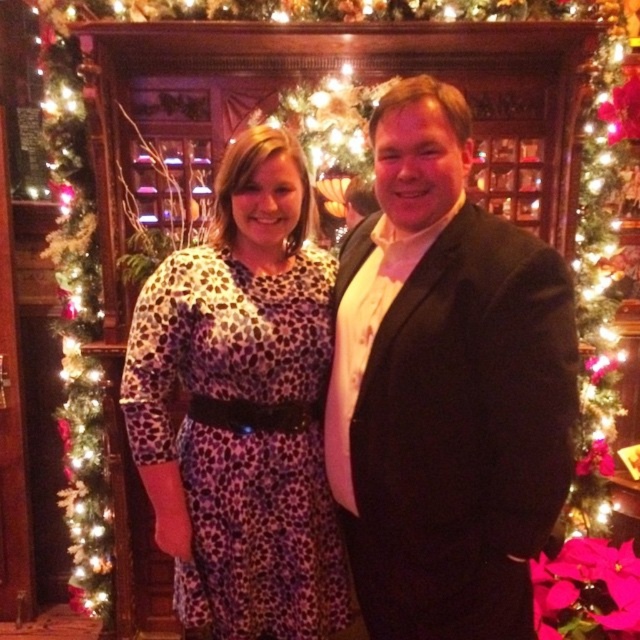
Is black satin suit at center to the right of green garland at left from the viewer's perspective?

Correct, you'll find black satin suit at center to the right of green garland at left.

Can you confirm if black satin suit at center is shorter than green garland at left?

Indeed, black satin suit at center has a lesser height compared to green garland at left.

Does point (499, 401) come farther from viewer compared to point (49, 36)?

No, (499, 401) is closer to viewer.

In order to click on black satin suit at center in this screenshot , I will do `click(445, 388)`.

Between green artificial christmas tree at left and green garland at left, which one is positioned higher?

green artificial christmas tree at left is higher up.

Consider the image. Is green artificial christmas tree at left smaller than green garland at left?

No.

At what (x,y) coordinates should I click in order to perform the action: click on green artificial christmas tree at left. Please return your answer as a coordinate pair (x, y). Image resolution: width=640 pixels, height=640 pixels. Looking at the image, I should click on (608, 256).

Where is `green artificial christmas tree at left`? green artificial christmas tree at left is located at coordinates (608, 256).

Is black satin suit at center positioned behind green artificial christmas tree at left?

That is False.

Which is above, black satin suit at center or green artificial christmas tree at left?

green artificial christmas tree at left is higher up.

Who is more distant from viewer, (554,349) or (624,193)?

The point (624,193) is behind.

Locate an element on the screen. Image resolution: width=640 pixels, height=640 pixels. black satin suit at center is located at coordinates (445, 388).